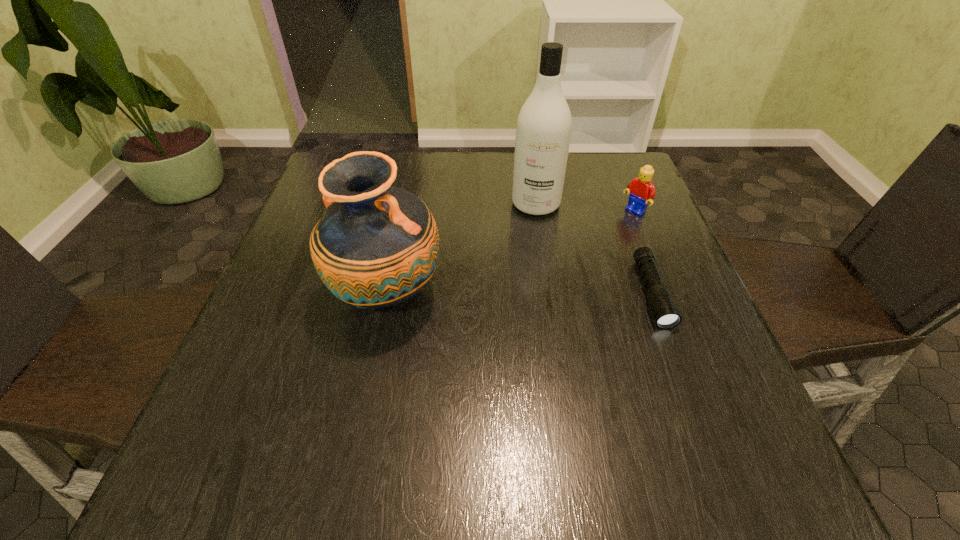
Locate an element on the screen. This screenshot has height=540, width=960. unoccupied position between the second tallest object and the flashlight is located at coordinates (519, 294).

Identify the location of vacant space in between the second shortest object and the pottery. The height and width of the screenshot is (540, 960). (510, 253).

Select which object appears as the second closest to the second tallest object. Please provide its 2D coordinates. Your answer should be formatted as a tuple, i.e. [(x, y)], where the tuple contains the x and y coordinates of a point satisfying the conditions above.

[(666, 315)]

Where is `object that is the closest to the third tallest object`? object that is the closest to the third tallest object is located at coordinates (666, 315).

Find the location of a particular element. free location that satisfies the following two spatial constraints: 1. on the back side of the shampoo; 2. on the left side of the leftmost object is located at coordinates (405, 204).